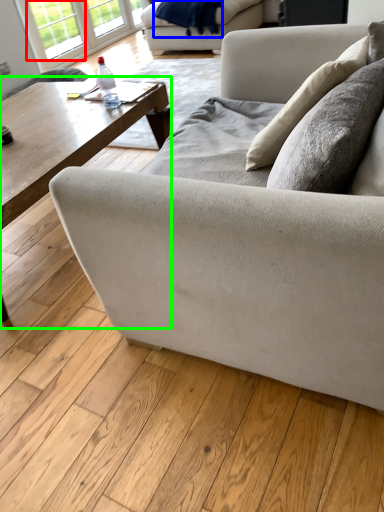
Question: Which object is positioned farthest from window (highlighted by a red box)? Select from blanket (highlighted by a blue box) and coffee table (highlighted by a green box).

Choices:
 (A) blanket
 (B) coffee table

Answer: (B)